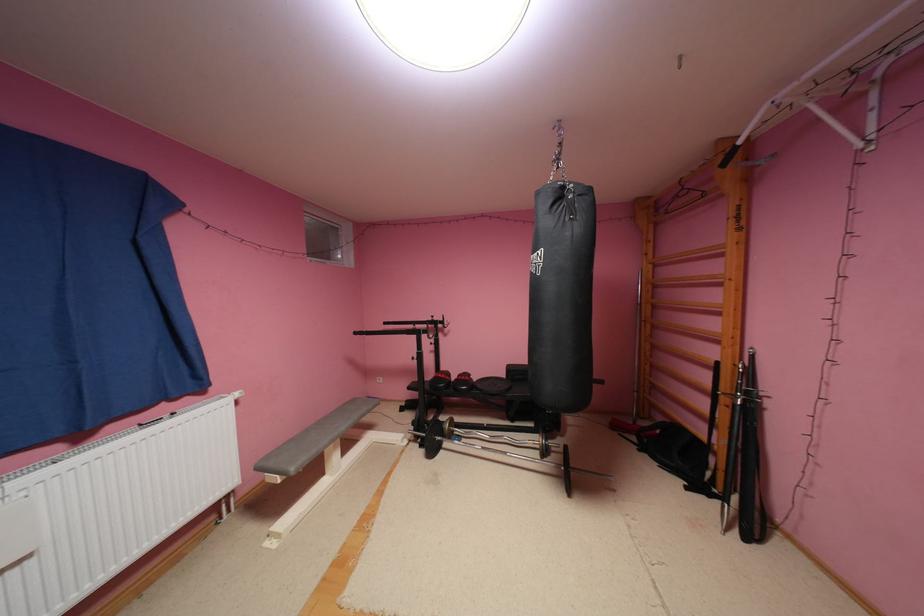
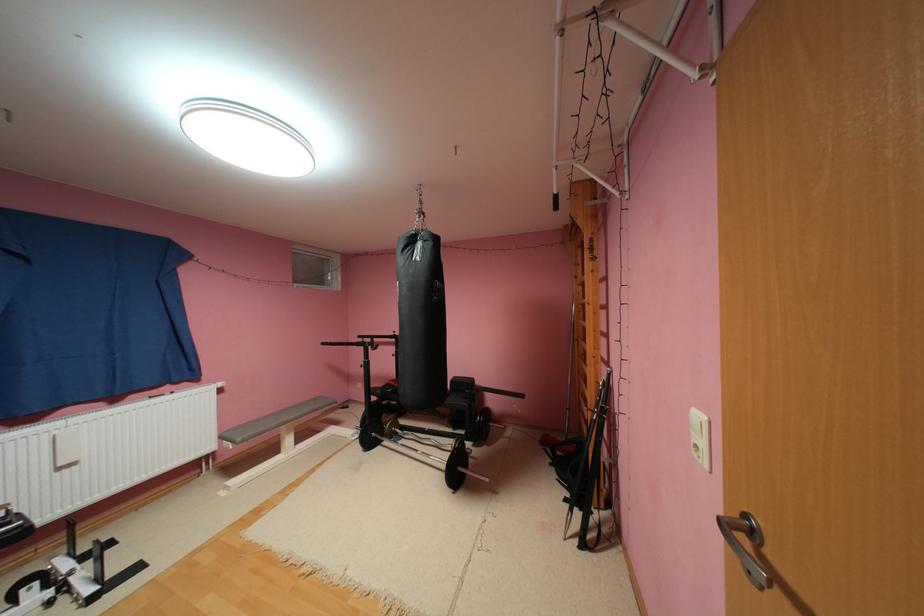
Locate, in the second image, the point that corresponds to point 696,488 in the first image.

(575, 500)